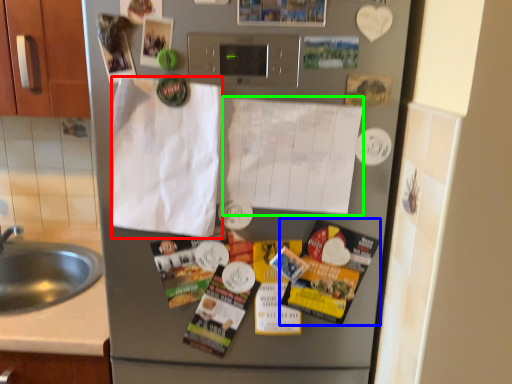
Question: Estimate the real-world distances between objects in this image. Which object is farther from envelope (highlighted by a red box), flyer (highlighted by a blue box) or paper (highlighted by a green box)?

Choices:
 (A) flyer
 (B) paper

Answer: (A)